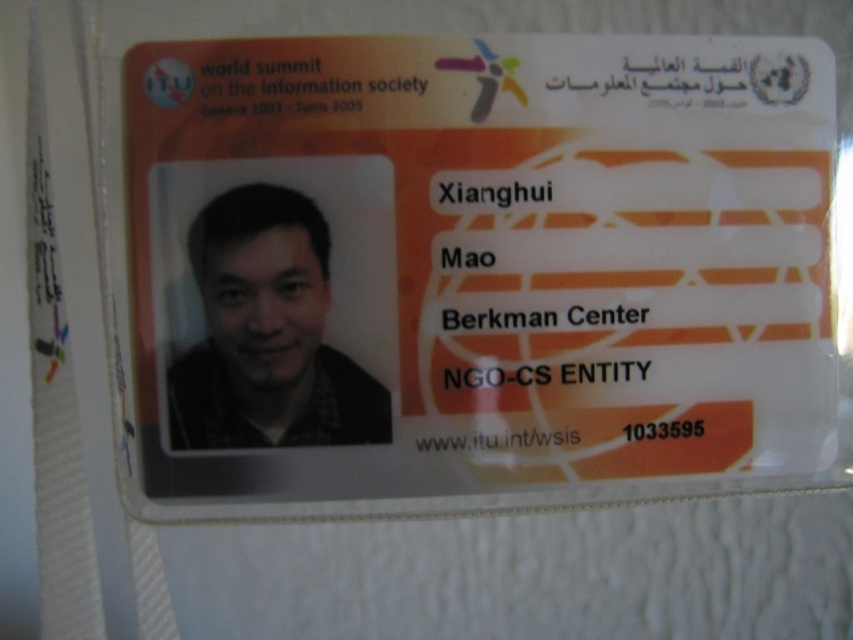
You are a security guard checking badges at the entrance. You notice an orange matte id card at center and a matte black photo at center on the badge. Which object is located to the right of the other?

The orange matte id card at center is positioned on the right side of matte black photo at center, so the orange matte id card at center is to the right of the matte black photo at center.

You are designing a display case for the badge and need to know the relative sizes of the orange matte id card at center and the matte black photo at center. Which one is taller?

The orange matte id card at center is taller than the matte black photo at center.